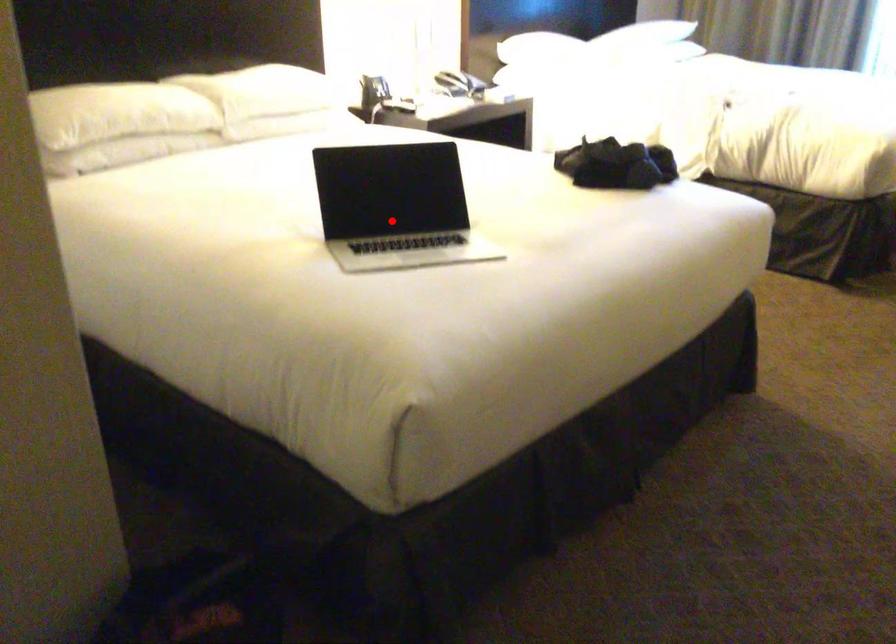
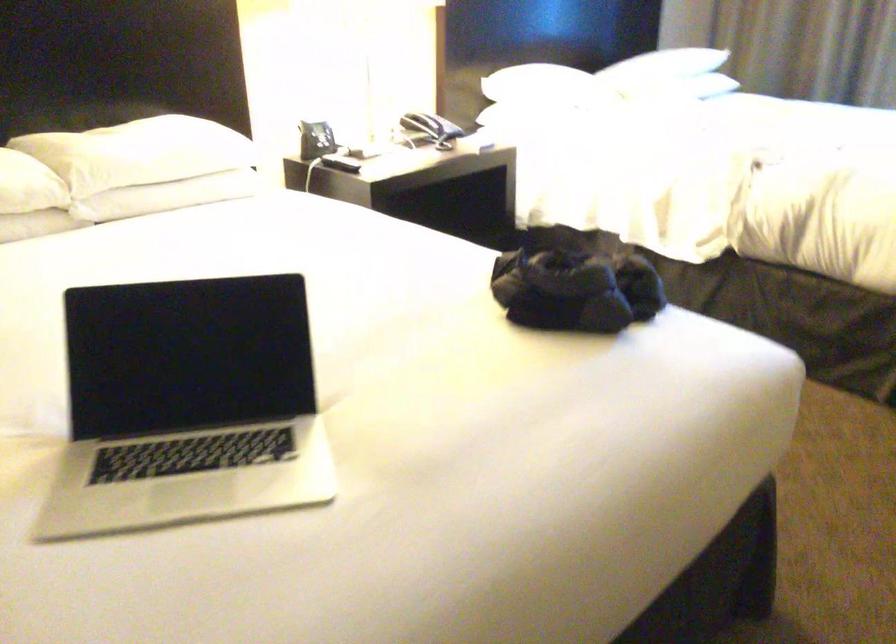
In the second image, find the point that corresponds to the highlighted location in the first image.

(186, 406)